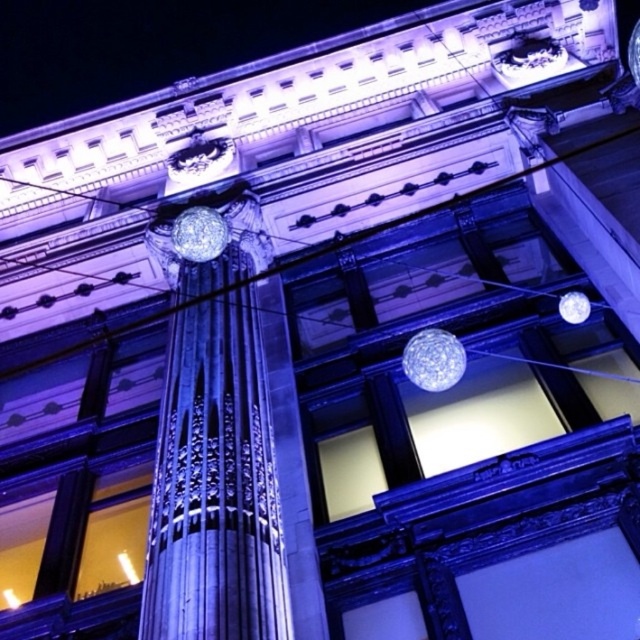
You are standing in front of the grand building and notice a point marked at coordinates (433, 358). What object is this point located on?

The point at (433, 358) is located on the transparent glass sphere at center.

You are standing in front of the grand building and notice two transparent glass spheres. Which one is closer to you, the transparent glass sphere at center or the transparent glass sphere at upper right?

The transparent glass sphere at center is closer to the viewer than the transparent glass sphere at upper right.